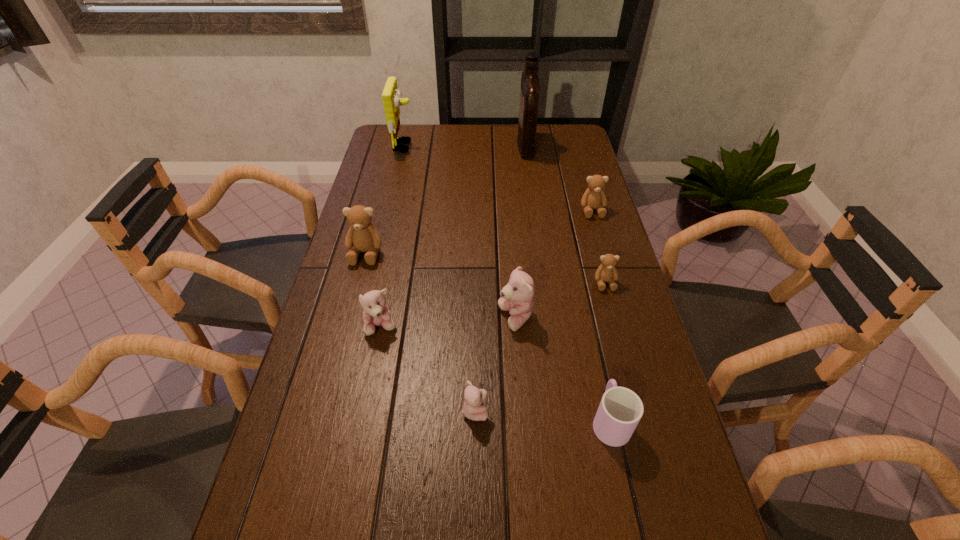
You are a GUI agent. You are given a task and a screenshot of the screen. Output one action in this format:
    pyautogui.click(x=<x>, y=<y>)
    Task: Click on the pink teddy bear that stands as the second closest to the third farthest teddy bear
    This screenshot has width=960, height=540.
    Given the screenshot: What is the action you would take?
    pyautogui.click(x=472, y=409)

Select which brown teddy bear is the third closest to the leftmost pink teddy bear. Please provide its 2D coordinates. Your answer should be formatted as a tuple, i.e. [(x, y)], where the tuple contains the x and y coordinates of a point satisfying the conditions above.

[(594, 197)]

Locate which brown teddy bear ranks in proximity to the smallest brown teddy bear. Please provide its 2D coordinates. Your answer should be formatted as a tuple, i.e. [(x, y)], where the tuple contains the x and y coordinates of a point satisfying the conditions above.

[(594, 197)]

Image resolution: width=960 pixels, height=540 pixels. I want to click on free location that satisfies the following two spatial constraints: 1. on the face of the second tallest object; 2. on the face of the second farthest teddy bear, so click(x=379, y=253).

The height and width of the screenshot is (540, 960). Find the location of `free region that satisfies the following two spatial constraints: 1. at the face of the fourth teddy bear from left to right; 2. at the face of the second biggest pink teddy bear`. free region that satisfies the following two spatial constraints: 1. at the face of the fourth teddy bear from left to right; 2. at the face of the second biggest pink teddy bear is located at coordinates (516, 327).